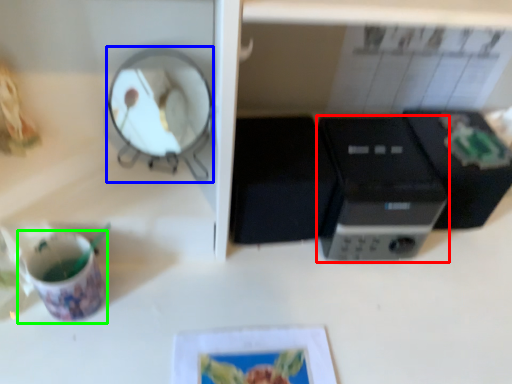
Question: Which object is the closest to the home appliance (highlighted by a red box)? Choose among these: mirror (highlighted by a blue box) or coffee cup (highlighted by a green box).

Choices:
 (A) mirror
 (B) coffee cup

Answer: (A)